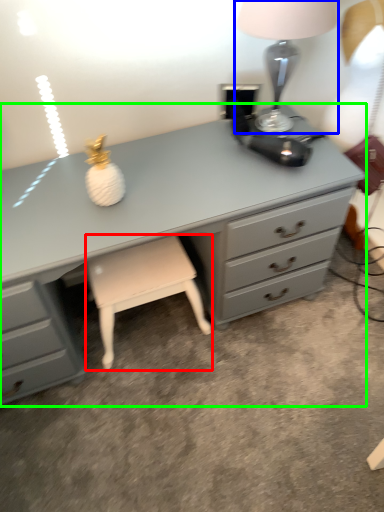
Question: Which object is the farthest from stool (highlighted by a red box)? Choose among these: table lamp (highlighted by a blue box) or chest of drawers (highlighted by a green box).

Choices:
 (A) table lamp
 (B) chest of drawers

Answer: (A)